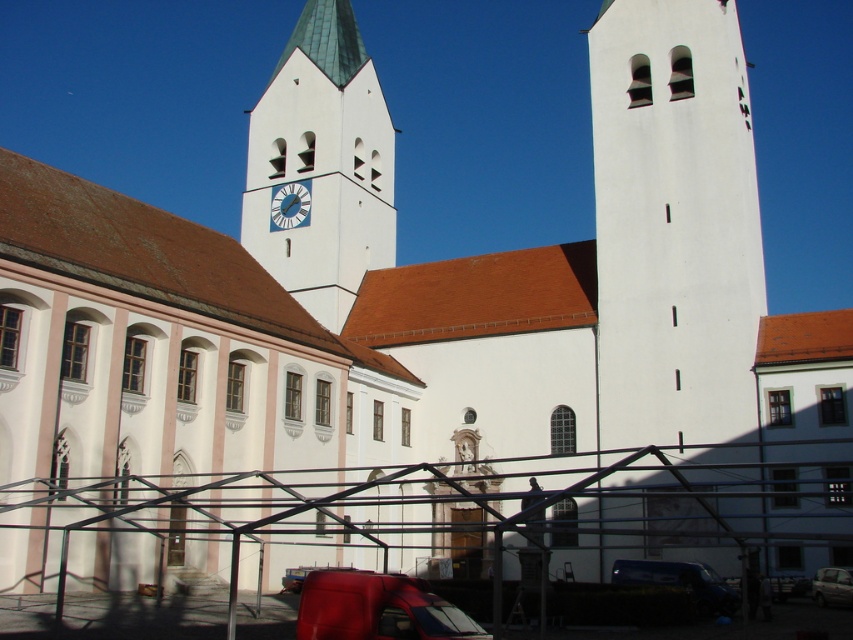
You are standing at the entrance of the church and want to locate the matte red van at lower center. According to the coordinates given, where should you look to find it?

The matte red van at lower center is located at coordinates point (376, 609), so you should look towards the lower center area of the scene to find it.